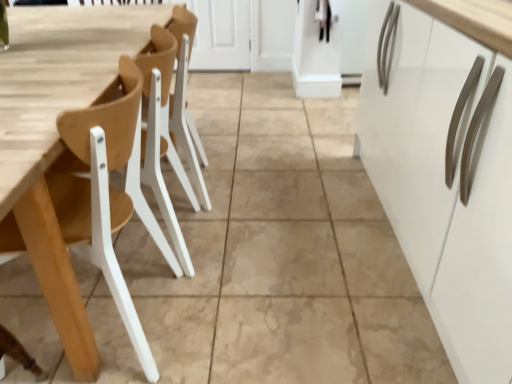
Question: Which is correct: wooden chair at left is inside natural wood table at left, or outside of it?

Choices:
 (A) outside
 (B) inside

Answer: (A)

Question: Is wooden chair at left wider or thinner than natural wood table at left?

Choices:
 (A) thin
 (B) wide

Answer: (B)

Question: Based on their positions, is wooden chair at left located to the left or right of natural wood table at left?

Choices:
 (A) left
 (B) right

Answer: (A)

Question: Is point (94, 69) positioned closer to the camera than point (74, 225)?

Choices:
 (A) closer
 (B) farther

Answer: (B)

Question: Would you say natural wood table at left is to the left or to the right of wooden chair at left in the picture?

Choices:
 (A) left
 (B) right

Answer: (B)

Question: From a real-world perspective, is natural wood table at left physically located above or below wooden chair at left?

Choices:
 (A) below
 (B) above

Answer: (A)

Question: Looking at their shapes, would you say natural wood table at left is wider or thinner than wooden chair at left?

Choices:
 (A) thin
 (B) wide

Answer: (A)